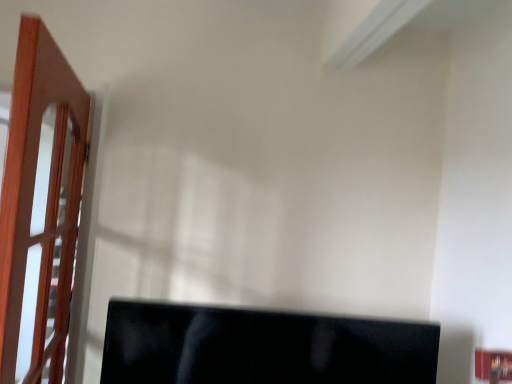
In order to face light brown wooden door at left, should I rotate leftwards or rightwards?

Turn left by 26.732 degrees to look at light brown wooden door at left.

What do you see at coordinates (33, 195) in the screenshot? The image size is (512, 384). I see `light brown wooden door at left` at bounding box center [33, 195].

Identify the location of light brown wooden door at left. The height and width of the screenshot is (384, 512). (33, 195).

The width and height of the screenshot is (512, 384). What do you see at coordinates (261, 347) in the screenshot?
I see `black glossy monitor at lower center` at bounding box center [261, 347].

Find the location of `black glossy monitor at lower center`. black glossy monitor at lower center is located at coordinates (261, 347).

Where is `light brown wooden door at left`? light brown wooden door at left is located at coordinates pos(33,195).

Between light brown wooden door at left and black glossy monitor at lower center, which one appears on the left side from the viewer's perspective?

Positioned to the left is light brown wooden door at left.

Considering their positions, is light brown wooden door at left located in front of or behind black glossy monitor at lower center?

In the image, light brown wooden door at left appears in front of black glossy monitor at lower center.

Does point (62, 164) lie behind point (292, 357)?

Yes, point (62, 164) is behind point (292, 357).

From the image's perspective, is light brown wooden door at left above or below black glossy monitor at lower center?

light brown wooden door at left is above black glossy monitor at lower center.

From a real-world perspective, between light brown wooden door at left and black glossy monitor at lower center, who is vertically higher?

light brown wooden door at left.

Which object is wider, light brown wooden door at left or black glossy monitor at lower center?

Wider between the two is black glossy monitor at lower center.

Does light brown wooden door at left have a lesser height compared to black glossy monitor at lower center?

In fact, light brown wooden door at left may be taller than black glossy monitor at lower center.

Is light brown wooden door at left smaller than black glossy monitor at lower center?

No.

Would you say light brown wooden door at left contains black glossy monitor at lower center?

Actually, black glossy monitor at lower center is outside light brown wooden door at left.

Is light brown wooden door at left positioned far away from black glossy monitor at lower center?

light brown wooden door at left is near black glossy monitor at lower center, not far away.

Is light brown wooden door at left positioned with its back to black glossy monitor at lower center?

That's right, light brown wooden door at left is facing away from black glossy monitor at lower center.

How different are the orientations of light brown wooden door at left and black glossy monitor at lower center in degrees?

The angular difference between light brown wooden door at left and black glossy monitor at lower center is 81.9 degrees.

Find the location of a particular element. door that is in front of the black glossy monitor at lower center is located at coordinates [x=33, y=195].

Considering the positions of objects black glossy monitor at lower center and light brown wooden door at left in the image provided, who is more to the right, black glossy monitor at lower center or light brown wooden door at left?

Positioned to the right is black glossy monitor at lower center.

Considering the positions of objects black glossy monitor at lower center and light brown wooden door at left in the image provided, who is in front, black glossy monitor at lower center or light brown wooden door at left?

light brown wooden door at left.

Does point (362, 369) lie behind point (19, 50)?

That is True.

In the scene shown: From the image's perspective, is black glossy monitor at lower center on light brown wooden door at left?

No, from the image's perspective, black glossy monitor at lower center is not above light brown wooden door at left.

From a real-world perspective, does black glossy monitor at lower center stand above light brown wooden door at left?

No, from a real-world perspective, black glossy monitor at lower center is not over light brown wooden door at left

Does black glossy monitor at lower center have a greater width compared to light brown wooden door at left?

Correct, the width of black glossy monitor at lower center exceeds that of light brown wooden door at left.

Who is taller, black glossy monitor at lower center or light brown wooden door at left?

Standing taller between the two is light brown wooden door at left.

Is black glossy monitor at lower center smaller than light brown wooden door at left?

Yes, black glossy monitor at lower center is smaller than light brown wooden door at left.

Is black glossy monitor at lower center spatially inside light brown wooden door at left, or outside of it?

black glossy monitor at lower center is spatially situated outside light brown wooden door at left.

Is black glossy monitor at lower center far away from light brown wooden door at left?

black glossy monitor at lower center is actually quite close to light brown wooden door at left.

Is light brown wooden door at left at the back of black glossy monitor at lower center?

No, black glossy monitor at lower center's orientation is not away from light brown wooden door at left.

Can you tell me how much black glossy monitor at lower center and light brown wooden door at left differ in facing direction?

The angular difference between black glossy monitor at lower center and light brown wooden door at left is 81.9 degrees.

The height and width of the screenshot is (384, 512). Identify the location of door located above the black glossy monitor at lower center (from the image's perspective). (33, 195).

Find the location of a particular element. door that is on the left side of black glossy monitor at lower center is located at coordinates coord(33,195).

You are a GUI agent. You are given a task and a screenshot of the screen. Output one action in this format:
    pyautogui.click(x=<x>, y=<y>)
    Task: Click on the door in front of the black glossy monitor at lower center
    Image resolution: width=512 pixels, height=384 pixels.
    Given the screenshot: What is the action you would take?
    pyautogui.click(x=33, y=195)